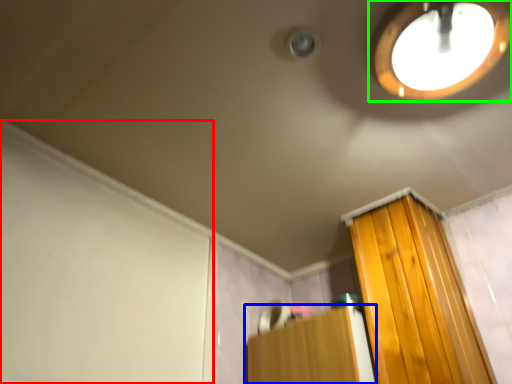
Question: Based on their relative distances, which object is farther from screen door (highlighted by a red box)? Choose from furniture (highlighted by a blue box) and droplight (highlighted by a green box).

Choices:
 (A) furniture
 (B) droplight

Answer: (B)